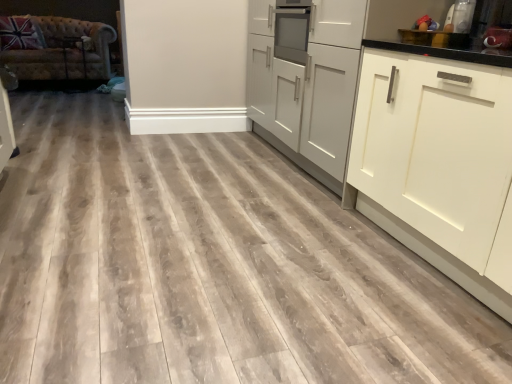
Question: Is tufted leather couch at left taller than white matte cabinet at right, positioned as the 1th cabinetry in right-to-left order?

Choices:
 (A) no
 (B) yes

Answer: (A)

Question: From a real-world perspective, is tufted leather couch at left beneath white matte cabinet at right, arranged as the 2th cabinetry when viewed from the left?

Choices:
 (A) yes
 (B) no

Answer: (A)

Question: Can you confirm if tufted leather couch at left is thinner than white matte cabinet at right, positioned as the 1th cabinetry in right-to-left order?

Choices:
 (A) yes
 (B) no

Answer: (B)

Question: Considering the relative positions of tufted leather couch at left and white matte cabinet at right, positioned as the 1th cabinetry in right-to-left order, in the image provided, is tufted leather couch at left to the left of white matte cabinet at right, positioned as the 1th cabinetry in right-to-left order, from the viewer's perspective?

Choices:
 (A) no
 (B) yes

Answer: (B)

Question: Is tufted leather couch at left oriented away from white matte cabinet at right, positioned as the 1th cabinetry in right-to-left order?

Choices:
 (A) no
 (B) yes

Answer: (A)

Question: Is tufted leather couch at left shorter than white matte cabinet at right, positioned as the 1th cabinetry in right-to-left order?

Choices:
 (A) no
 (B) yes

Answer: (B)

Question: From the image's perspective, is white matte cabinet at right, positioned as the 1th cabinetry in right-to-left order, located beneath metallic silver toaster at upper right, the 2th appliance positioned from the left?

Choices:
 (A) no
 (B) yes

Answer: (B)

Question: Is the depth of white matte cabinet at right, positioned as the 1th cabinetry in right-to-left order, greater than that of metallic silver toaster at upper right, the 2th appliance positioned from the left?

Choices:
 (A) yes
 (B) no

Answer: (B)

Question: Is white matte cabinet at right, arranged as the 2th cabinetry when viewed from the left, taller than metallic silver toaster at upper right, the 2th appliance positioned from the left?

Choices:
 (A) no
 (B) yes

Answer: (B)

Question: From a real-world perspective, is white matte cabinet at right, positioned as the 1th cabinetry in right-to-left order, physically below metallic silver toaster at upper right, which appears as the first appliance when viewed from the right?

Choices:
 (A) no
 (B) yes

Answer: (B)

Question: Is white matte cabinet at right, arranged as the 2th cabinetry when viewed from the left, to the right of metallic silver toaster at upper right, the 2th appliance positioned from the left, from the viewer's perspective?

Choices:
 (A) no
 (B) yes

Answer: (A)

Question: Does white matte cabinet at right, positioned as the 1th cabinetry in right-to-left order, turn towards metallic silver toaster at upper right, the 2th appliance positioned from the left?

Choices:
 (A) no
 (B) yes

Answer: (A)

Question: Does metallic silver toaster at upper right, the second appliance in the right-to-left sequence, have a greater height compared to tufted leather couch at left?

Choices:
 (A) yes
 (B) no

Answer: (B)